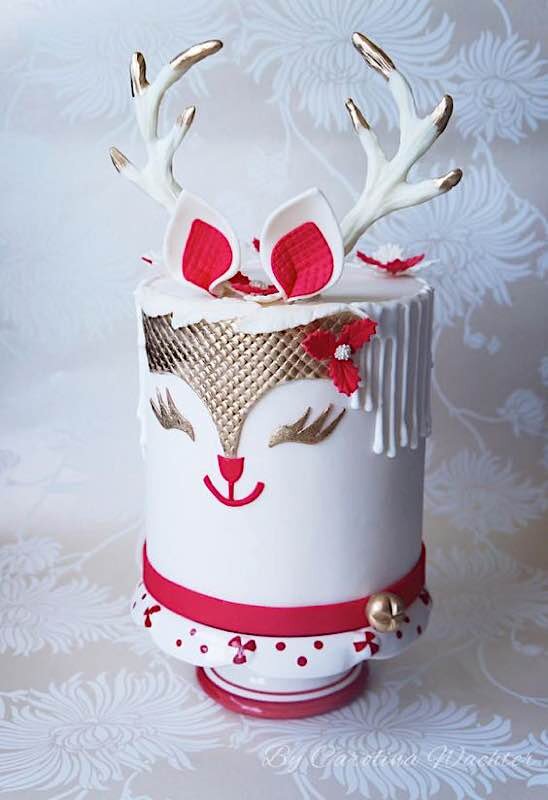
What are the coordinates of `floral pattern` in the screenshot? It's located at click(x=135, y=720), click(x=54, y=593), click(x=428, y=734).